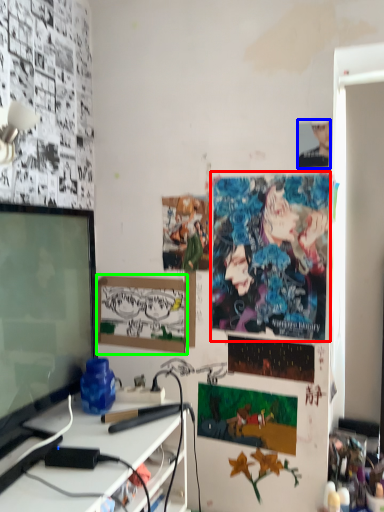
Question: Estimate the real-world distances between objects in this image. Which object is closer to poster page (highlighted by a red box), person (highlighted by a blue box) or picture frame (highlighted by a green box)?

Choices:
 (A) person
 (B) picture frame

Answer: (B)